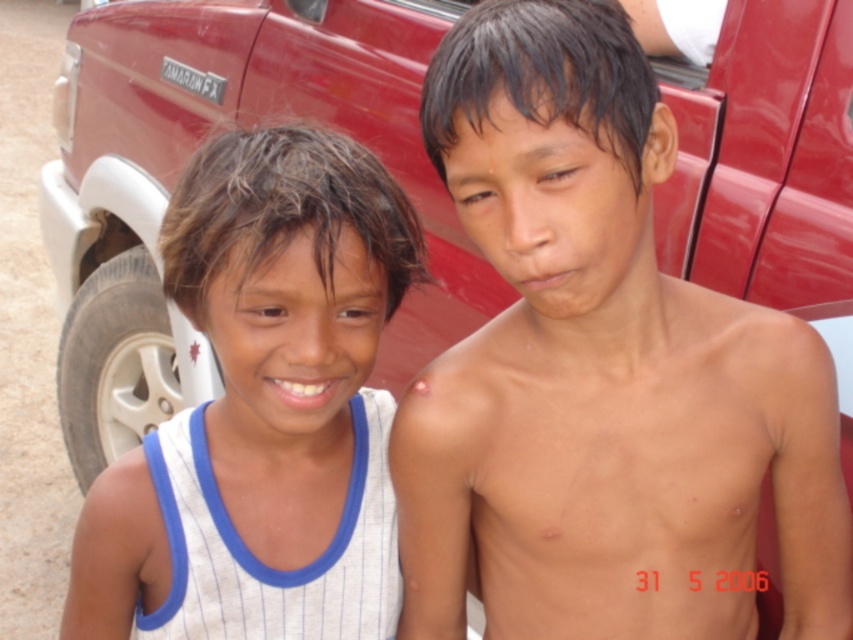
Question: Which point appears farthest from the camera in this image?

Choices:
 (A) click(x=259, y=403)
 (B) click(x=387, y=72)

Answer: (B)

Question: Can you confirm if smooth skin boy at center is positioned to the left of matte red truck at upper center?

Choices:
 (A) yes
 (B) no

Answer: (B)

Question: Which point appears closest to the camera in this image?

Choices:
 (A) (409, 464)
 (B) (165, 72)

Answer: (A)

Question: Does smooth skin boy at center appear under white striped tank top at left?

Choices:
 (A) yes
 (B) no

Answer: (B)

Question: Which object is the farthest from the white striped tank top at left?

Choices:
 (A) smooth skin boy at center
 (B) matte red truck at upper center

Answer: (B)

Question: Is smooth skin boy at center positioned behind white striped tank top at left?

Choices:
 (A) no
 (B) yes

Answer: (A)